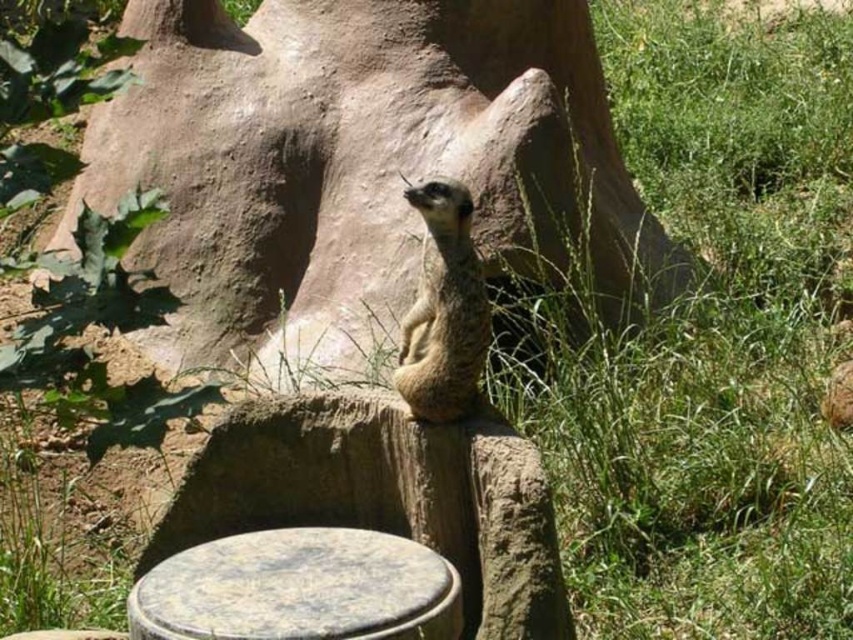
You are a photographer aiming to capture the speckled stone stool at center in your shot. Based on the coordinates provided, where should you position your camera to ensure the stool is centered in the frame?

The speckled stone stool at center is located at coordinates point [299,588], so positioning the camera directly facing those coordinates will center the stool in the frame.

You are a photographer trying to capture the meerkat in the center of the image. You notice two points marked on your screen at coordinates point (x=392, y=608) and point (x=450, y=236). Which point is closer to the camera and thus appears larger in your photo?

Point (x=392, y=608) is closer to the camera than point (x=450, y=236), so it will appear larger in the photo.

You are a small animal that needs to climb onto the speckled stone stool at center. Given that the furry brown meerkat at center is already sitting there, can you tell me if the stool is big enough for both of you to sit comfortably?

The speckled stone stool at center is larger in size than the furry brown meerkat at center, so there should be enough space for both of you to sit comfortably.